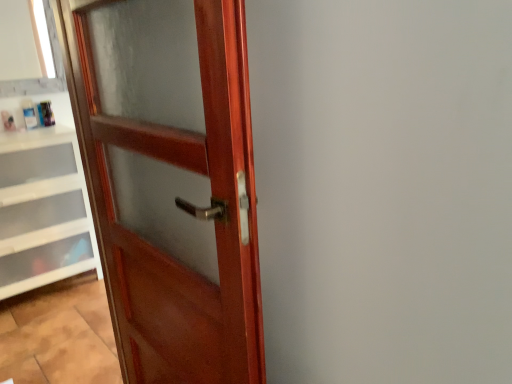
Question: From the image's perspective, is glossy wood door at left below matte wood window frame at upper left?

Choices:
 (A) no
 (B) yes

Answer: (B)

Question: Is glossy wood door at left at the right side of matte wood window frame at upper left?

Choices:
 (A) yes
 (B) no

Answer: (A)

Question: Is glossy wood door at left further to camera compared to matte wood window frame at upper left?

Choices:
 (A) no
 (B) yes

Answer: (A)

Question: Is glossy wood door at left positioned with its back to matte wood window frame at upper left?

Choices:
 (A) no
 (B) yes

Answer: (A)

Question: Considering the relative sizes of glossy wood door at left and matte wood window frame at upper left in the image provided, is glossy wood door at left thinner than matte wood window frame at upper left?

Choices:
 (A) yes
 (B) no

Answer: (B)

Question: Is point (79, 228) closer or farther from the camera than point (233, 72)?

Choices:
 (A) closer
 (B) farther

Answer: (B)

Question: From the image's perspective, relative to glossy wood door at left, is white plastic drawers at lower left above or below?

Choices:
 (A) below
 (B) above

Answer: (B)

Question: In the image, is white plastic drawers at lower left on the left side or the right side of glossy wood door at left?

Choices:
 (A) right
 (B) left

Answer: (B)

Question: Considering their positions, is white plastic drawers at lower left located in front of or behind glossy wood door at left?

Choices:
 (A) behind
 (B) front

Answer: (A)

Question: Is point (51, 152) closer or farther from the camera than point (36, 87)?

Choices:
 (A) farther
 (B) closer

Answer: (B)

Question: Visually, is white plastic drawers at lower left positioned to the left or to the right of matte wood window frame at upper left?

Choices:
 (A) right
 (B) left

Answer: (A)

Question: Is white plastic drawers at lower left taller or shorter than matte wood window frame at upper left?

Choices:
 (A) short
 (B) tall

Answer: (B)

Question: Do you think white plastic drawers at lower left is within matte wood window frame at upper left, or outside of it?

Choices:
 (A) inside
 (B) outside

Answer: (B)

Question: From the image's perspective, is glossy wood door at left above or below white plastic drawers at lower left?

Choices:
 (A) below
 (B) above

Answer: (A)

Question: Is glossy wood door at left inside the boundaries of white plastic drawers at lower left, or outside?

Choices:
 (A) outside
 (B) inside

Answer: (A)